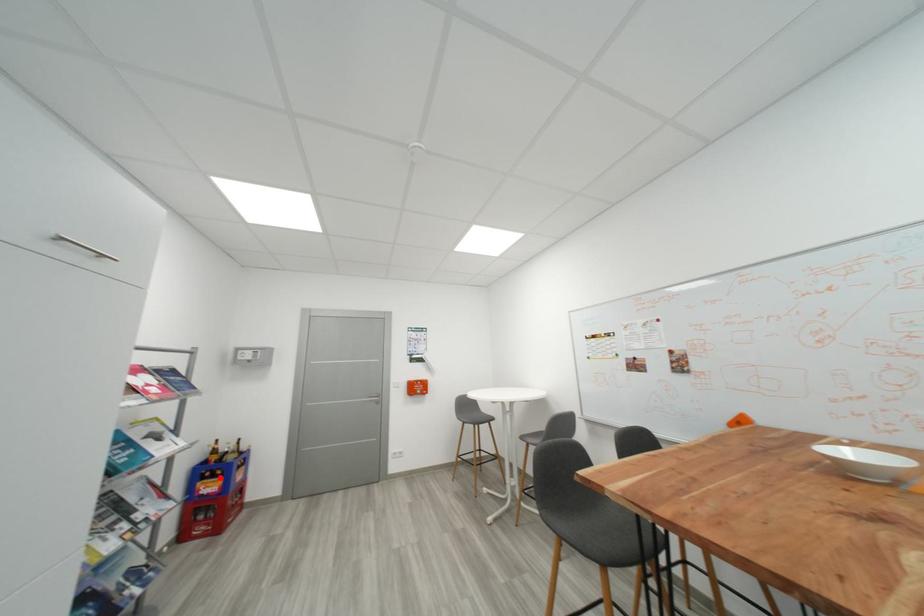
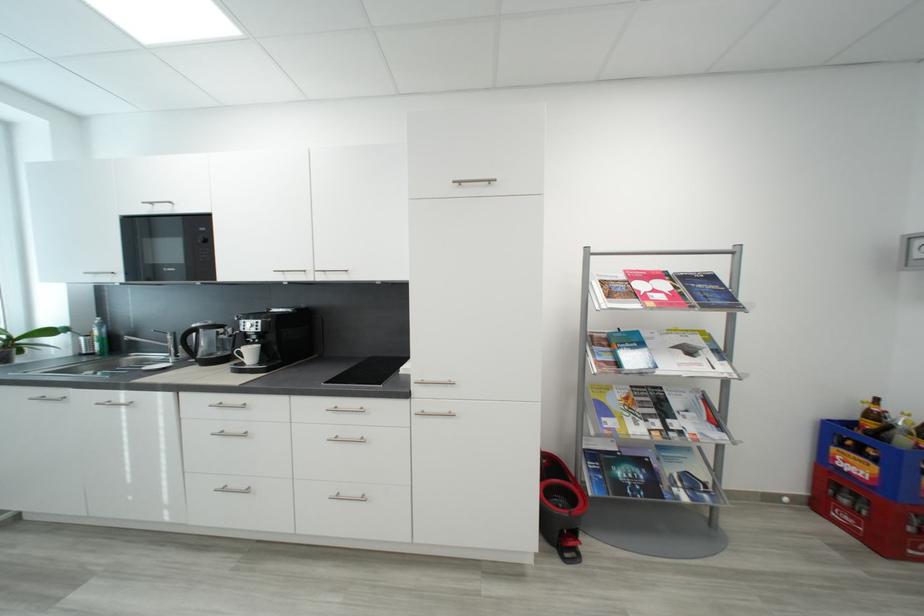
Find the pixel in the second image that matches the highlighted location in the first image.

(867, 454)